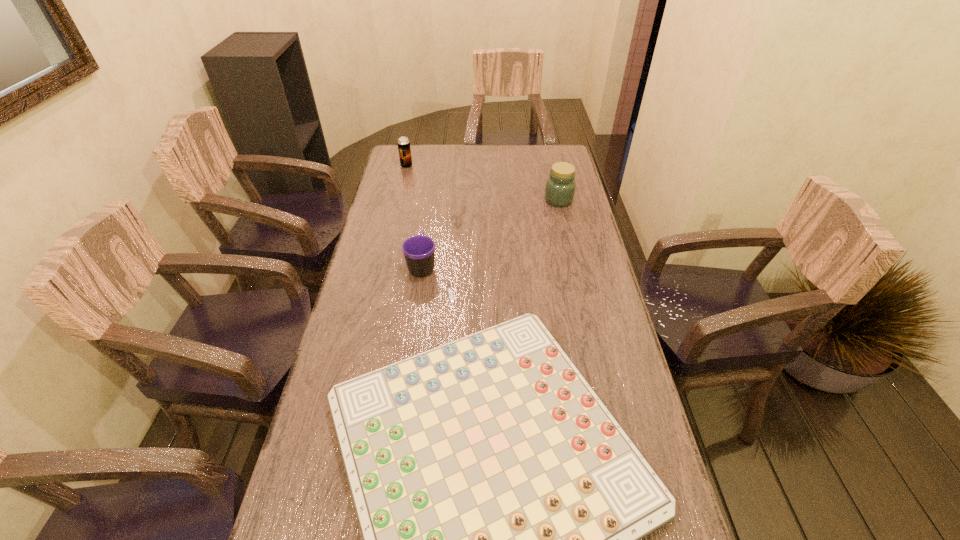
The width and height of the screenshot is (960, 540). Find the location of `the second farthest object`. the second farthest object is located at coordinates (560, 187).

Identify the location of the farthest object. [x=404, y=149].

This screenshot has width=960, height=540. I want to click on the second nearest object, so click(419, 251).

Find the location of `mug`. mug is located at coordinates (419, 251).

Locate an element on the screen. vacant position located on the left of the jar is located at coordinates (520, 200).

At what (x,y) coordinates should I click in order to perform the action: click on vacant region located 0.150m on the back of the farthest object. Please return your answer as a coordinate pair (x, y). The image size is (960, 540). Looking at the image, I should click on coord(411,146).

Locate an element on the screen. This screenshot has height=540, width=960. free point located with the handle on the side of the second shortest object is located at coordinates pyautogui.click(x=433, y=188).

At what (x,y) coordinates should I click in order to perform the action: click on vacant space positioned with the handle on the side of the second shortest object. Please return your answer as a coordinate pair (x, y). Image resolution: width=960 pixels, height=540 pixels. Looking at the image, I should click on (426, 237).

The width and height of the screenshot is (960, 540). I want to click on vacant region located 0.200m with the handle on the side of the second shortest object, so click(429, 216).

Find the location of a particular element. object that is positioned at the far edge is located at coordinates (404, 149).